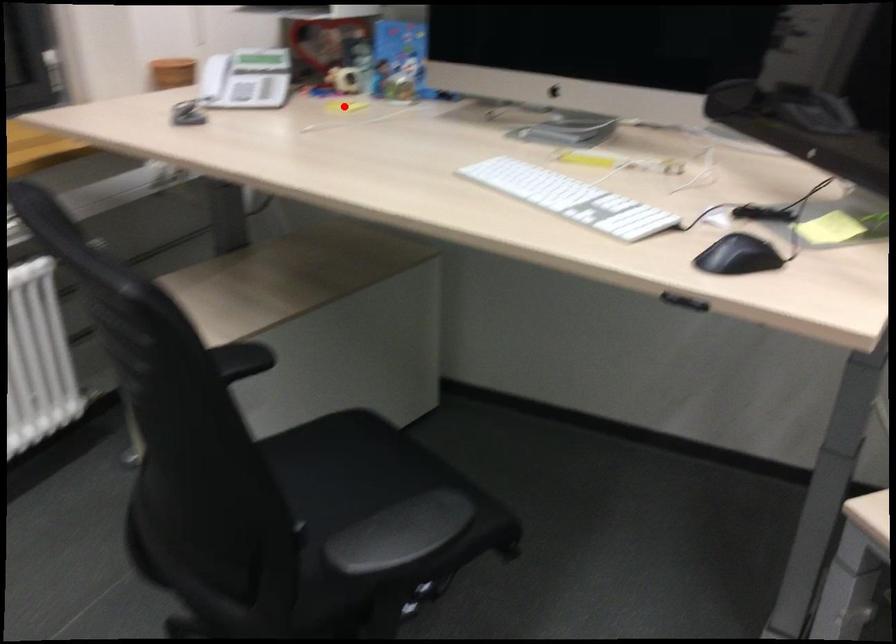
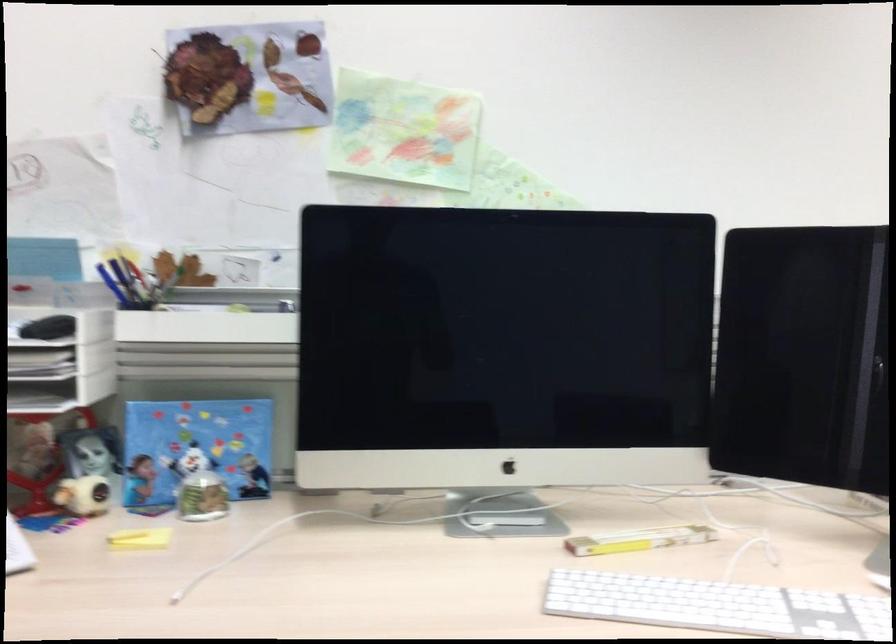
Locate, in the second image, the point that corresponds to the highlighted location in the first image.

(140, 538)